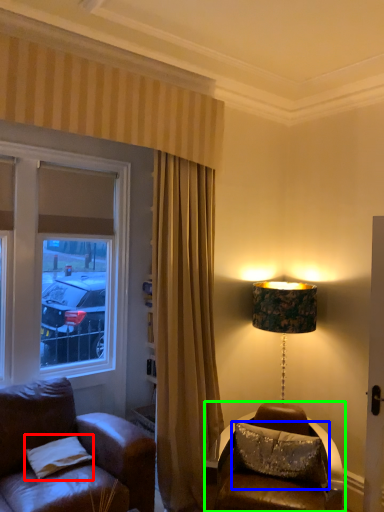
Question: Based on their relative distances, which object is nearer to pillow (highlighted by a red box)? Choose from pillow (highlighted by a blue box) and table (highlighted by a green box).

Choices:
 (A) pillow
 (B) table

Answer: (B)